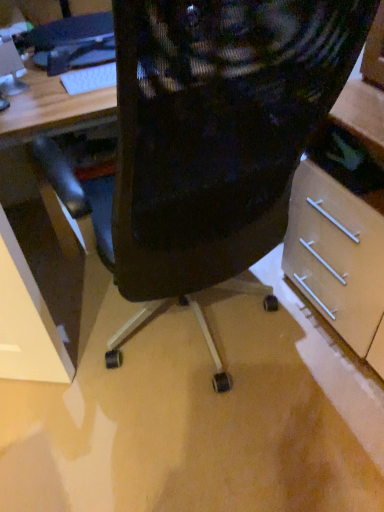
Question: Considering the relative sizes of black mesh chair at center and matte black monitor at upper left in the image provided, is black mesh chair at center wider than matte black monitor at upper left?

Choices:
 (A) no
 (B) yes

Answer: (B)

Question: Considering the relative sizes of black mesh chair at center and matte black monitor at upper left in the image provided, is black mesh chair at center shorter than matte black monitor at upper left?

Choices:
 (A) yes
 (B) no

Answer: (B)

Question: From the image's perspective, is black mesh chair at center beneath matte black monitor at upper left?

Choices:
 (A) no
 (B) yes

Answer: (B)

Question: Does black mesh chair at center have a larger size compared to matte black monitor at upper left?

Choices:
 (A) yes
 (B) no

Answer: (A)

Question: Does black mesh chair at center have a greater height compared to matte black monitor at upper left?

Choices:
 (A) no
 (B) yes

Answer: (B)

Question: From the image's perspective, is black mesh chair at center located above matte black monitor at upper left?

Choices:
 (A) yes
 (B) no

Answer: (B)

Question: Is matte black monitor at upper left outside of white plastic keyboard at upper left?

Choices:
 (A) no
 (B) yes

Answer: (B)

Question: Is matte black monitor at upper left thinner than white plastic keyboard at upper left?

Choices:
 (A) yes
 (B) no

Answer: (A)

Question: Is matte black monitor at upper left taller than white plastic keyboard at upper left?

Choices:
 (A) no
 (B) yes

Answer: (B)

Question: Is matte black monitor at upper left positioned with its back to white plastic keyboard at upper left?

Choices:
 (A) no
 (B) yes

Answer: (A)

Question: Considering the relative positions of matte black monitor at upper left and white plastic keyboard at upper left in the image provided, is matte black monitor at upper left behind white plastic keyboard at upper left?

Choices:
 (A) no
 (B) yes

Answer: (A)

Question: Is matte black monitor at upper left positioned before white plastic keyboard at upper left?

Choices:
 (A) no
 (B) yes

Answer: (B)

Question: Is black plastic keyboard at upper left further to camera compared to matte black monitor at upper left?

Choices:
 (A) no
 (B) yes

Answer: (B)